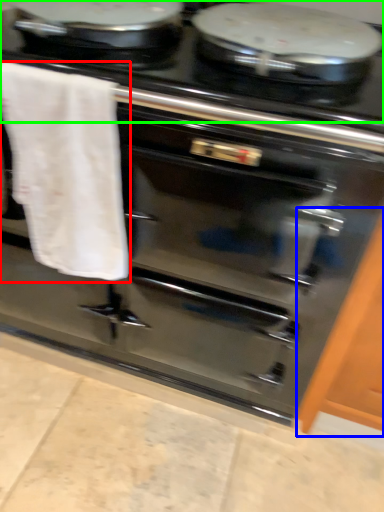
Question: Based on their relative distances, which object is nearer to bath towel (highlighted by a red box)? Choose from cabinetry (highlighted by a blue box) and gas stove (highlighted by a green box).

Choices:
 (A) cabinetry
 (B) gas stove

Answer: (B)